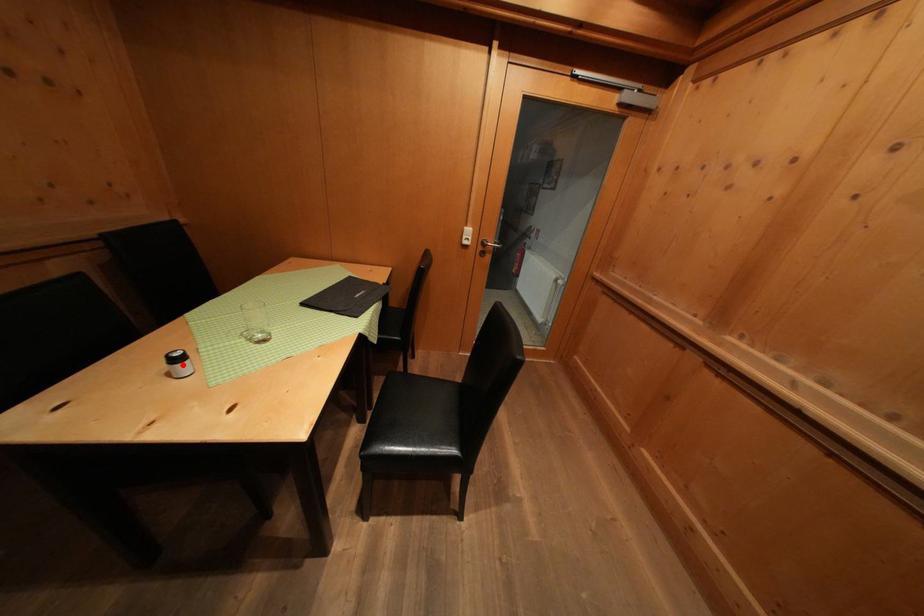
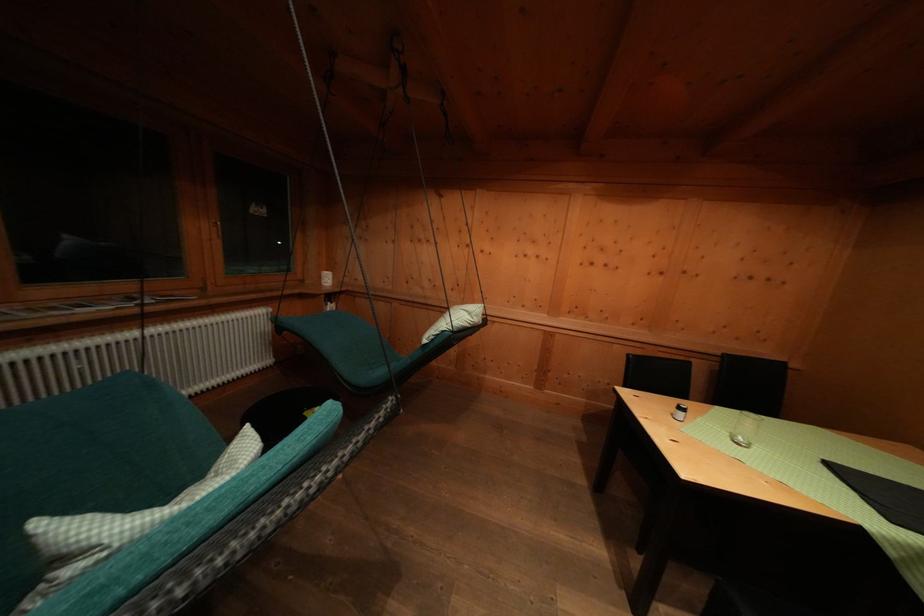
In the second image, find the point that corresponds to the highlighted location in the first image.

(687, 413)